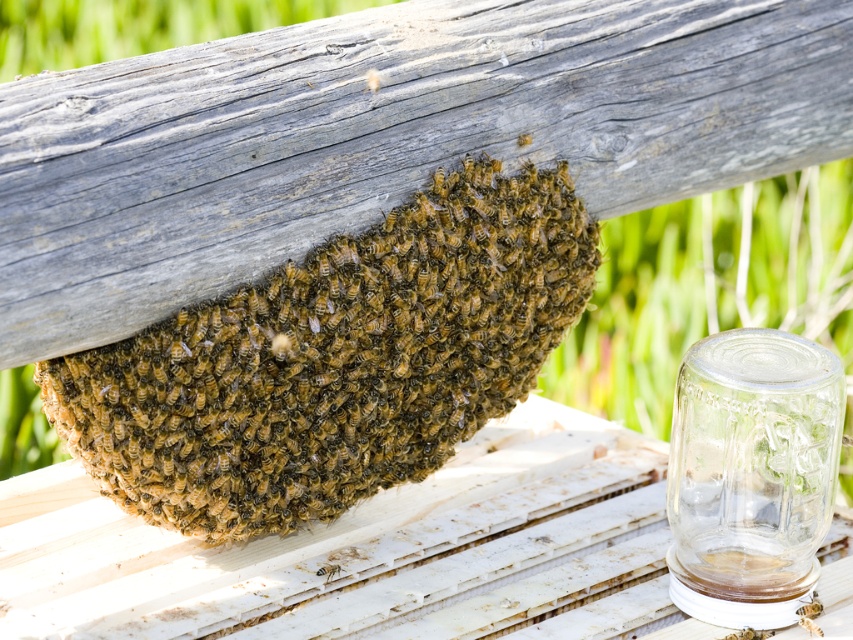
You are a beekeeper trying to inspect the hive. You notice the brown fuzzy beehive at center and the translucent yellowish honeycomb at lower center. Which one is located to the right of the other?

The brown fuzzy beehive at center is positioned on the right side of the translucent yellowish honeycomb at lower center.

You are a beekeeper observing the beehive and honeycomb. Which object is bigger between the brown fuzzy beehive at center and the translucent yellowish honeycomb at lower center?

The brown fuzzy beehive at center is larger in size than the translucent yellowish honeycomb at lower center.